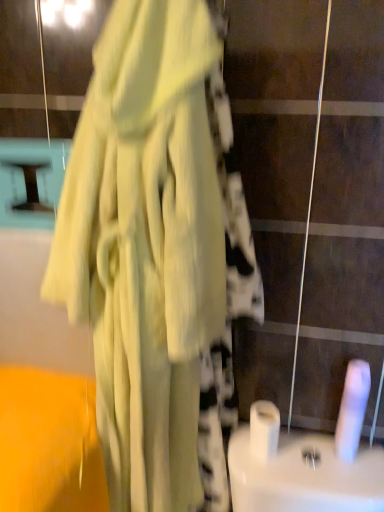
Question: Considering the relative sizes of white glossy toilet paper at center, placed as the second toilet paper when sorted from right to left, and matte yellow dress at center in the image provided, is white glossy toilet paper at center, placed as the second toilet paper when sorted from right to left, bigger than matte yellow dress at center?

Choices:
 (A) no
 (B) yes

Answer: (A)

Question: From a real-world perspective, is white glossy toilet paper at center, placed as the second toilet paper when sorted from right to left, on top of matte yellow dress at center?

Choices:
 (A) no
 (B) yes

Answer: (A)

Question: Is white glossy toilet paper at center, placed as the second toilet paper when sorted from right to left, closer to camera compared to matte yellow dress at center?

Choices:
 (A) yes
 (B) no

Answer: (B)

Question: Is white glossy toilet paper at center, placed as the 1th toilet paper when sorted from left to right, taller than matte yellow dress at center?

Choices:
 (A) yes
 (B) no

Answer: (B)

Question: Considering the relative sizes of white glossy toilet paper at center, placed as the 1th toilet paper when sorted from left to right, and matte yellow dress at center in the image provided, is white glossy toilet paper at center, placed as the 1th toilet paper when sorted from left to right, smaller than matte yellow dress at center?

Choices:
 (A) no
 (B) yes

Answer: (B)

Question: Considering the positions of white glossy toilet paper at center, placed as the 1th toilet paper when sorted from left to right, and white matte toilet paper at lower right, which ranks as the second toilet paper in left-to-right order, in the image, is white glossy toilet paper at center, placed as the 1th toilet paper when sorted from left to right, taller or shorter than white matte toilet paper at lower right, which ranks as the second toilet paper in left-to-right order,?

Choices:
 (A) tall
 (B) short

Answer: (B)

Question: Does point (274, 406) appear closer or farther from the camera than point (342, 400)?

Choices:
 (A) farther
 (B) closer

Answer: (A)

Question: Looking at their shapes, would you say white glossy toilet paper at center, placed as the second toilet paper when sorted from right to left, is wider or thinner than white matte toilet paper at lower right, the first toilet paper when ordered from right to left?

Choices:
 (A) thin
 (B) wide

Answer: (B)

Question: From a real-world perspective, is white glossy toilet paper at center, placed as the second toilet paper when sorted from right to left, positioned above or below white matte toilet paper at lower right, which ranks as the second toilet paper in left-to-right order?

Choices:
 (A) below
 (B) above

Answer: (A)

Question: From a real-world perspective, relative to white matte toilet paper at lower right, the first toilet paper when ordered from right to left, is matte yellow dress at center vertically above or below?

Choices:
 (A) below
 (B) above

Answer: (B)

Question: Looking at their shapes, would you say matte yellow dress at center is wider or thinner than white matte toilet paper at lower right, which ranks as the second toilet paper in left-to-right order?

Choices:
 (A) wide
 (B) thin

Answer: (A)

Question: Is point (226, 119) positioned closer to the camera than point (364, 377)?

Choices:
 (A) closer
 (B) farther

Answer: (A)

Question: Looking at the image, does matte yellow dress at center seem bigger or smaller compared to white matte toilet paper at lower right, the first toilet paper when ordered from right to left?

Choices:
 (A) big
 (B) small

Answer: (A)

Question: From the image's perspective, is matte yellow dress at center above or below white glossy toilet paper at center, placed as the second toilet paper when sorted from right to left?

Choices:
 (A) below
 (B) above

Answer: (B)

Question: Does point (127, 371) appear closer or farther from the camera than point (264, 429)?

Choices:
 (A) farther
 (B) closer

Answer: (B)